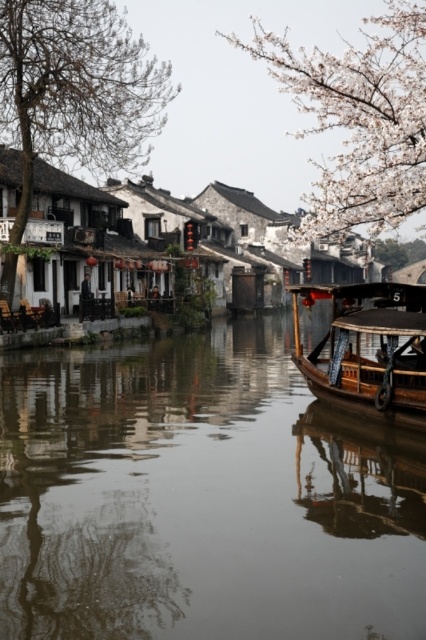
Question: Does smooth brown water at center appear on the left side of white blossoming branches at upper right?

Choices:
 (A) yes
 (B) no

Answer: (A)

Question: Which object is positioned closest to the wooden boat at right?

Choices:
 (A) smooth brown water at center
 (B) white blossoming branches at upper right
 (C) bare branches at left

Answer: (A)

Question: Where is bare branches at left located in relation to wooden boat at right in the image?

Choices:
 (A) above
 (B) below

Answer: (A)

Question: Which object is positioned farthest from the smooth brown water at center?

Choices:
 (A) bare branches at left
 (B) wooden boat at right

Answer: (A)

Question: Does bare branches at left come in front of white blossoming branches at upper right?

Choices:
 (A) no
 (B) yes

Answer: (A)

Question: Which object is the farthest from the smooth brown water at center?

Choices:
 (A) bare branches at left
 (B) wooden boat at right

Answer: (A)